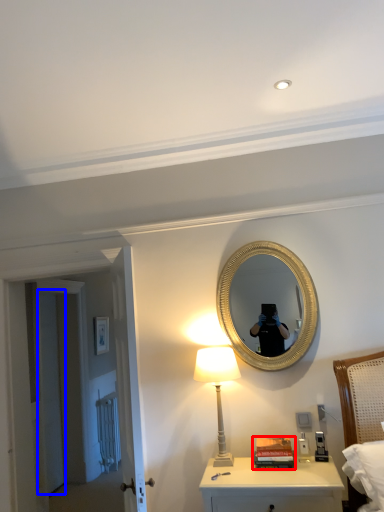
Question: Which object appears closest to the camera in this image, book (highlighted by a red box) or door (highlighted by a blue box)?

Choices:
 (A) book
 (B) door

Answer: (A)